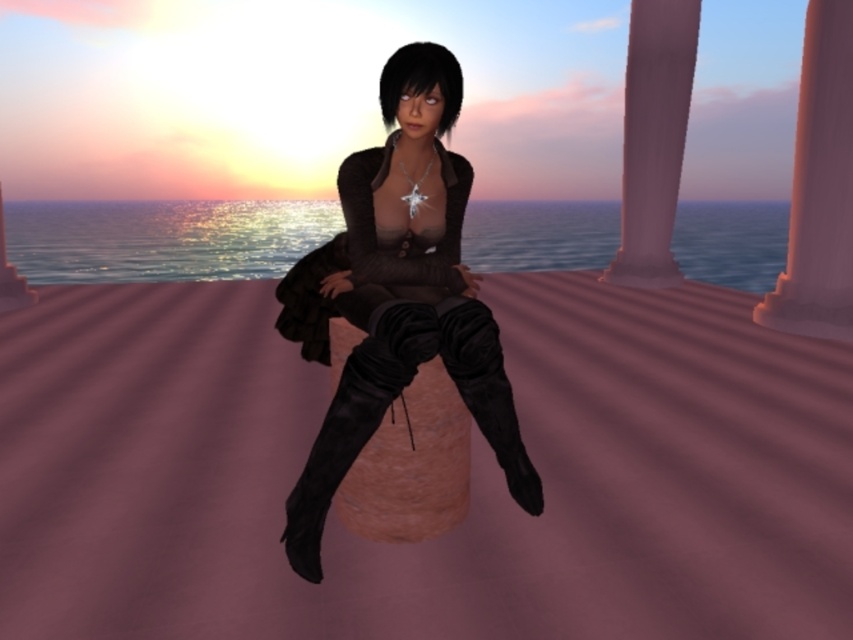
Question: Can you confirm if matte black boots at center is positioned to the right of pink marble pillar at upper right?

Choices:
 (A) yes
 (B) no

Answer: (B)

Question: Which object is positioned farthest from the smooth pink stone pillar at right?

Choices:
 (A) matte black boots at center
 (B) pink marble pillar at upper right

Answer: (A)

Question: Based on their relative distances, which object is farther from the matte black boots at center?

Choices:
 (A) pink marble pillar at upper right
 (B) smooth pink stone pillar at right

Answer: (A)

Question: Which is farther from the pink marble pillar at upper right?

Choices:
 (A) matte black boots at center
 (B) smooth pink stone pillar at right

Answer: (A)

Question: Does matte black boots at center appear under smooth pink stone pillar at right?

Choices:
 (A) yes
 (B) no

Answer: (A)

Question: Can you confirm if matte black boots at center is positioned to the left of pink marble pillar at upper right?

Choices:
 (A) yes
 (B) no

Answer: (A)